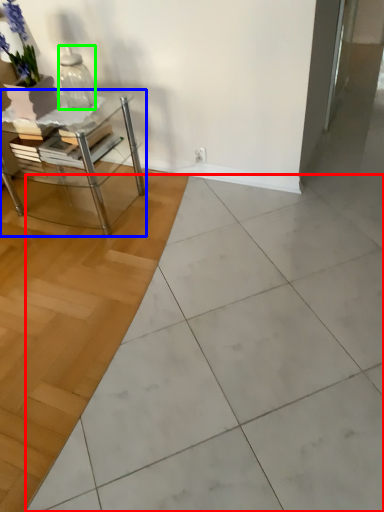
Question: Which object is the farthest from ceramic tile (highlighted by a red box)? Choose among these: table (highlighted by a blue box) or vase (highlighted by a green box).

Choices:
 (A) table
 (B) vase

Answer: (B)